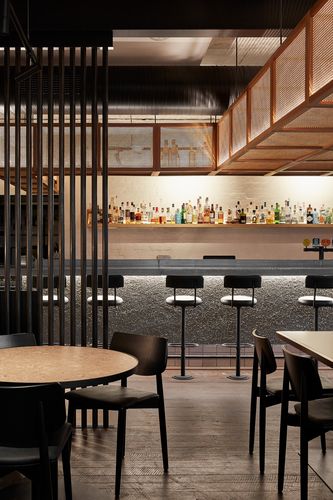
Locate an element on the screen. Image resolution: width=333 pixels, height=500 pixels. wooden shelf is located at coordinates (203, 226).